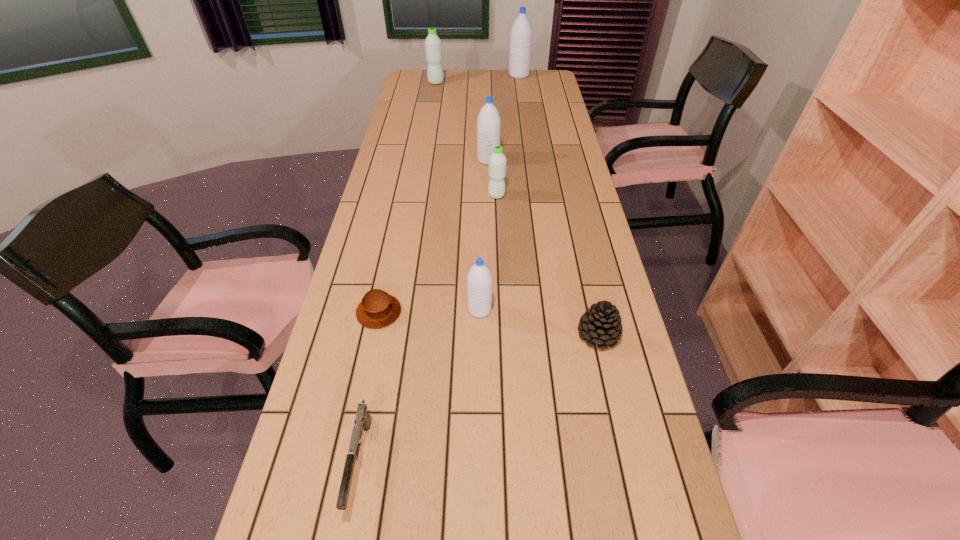
Image resolution: width=960 pixels, height=540 pixels. Identify the location of pinecone. (600, 325).

Where is `the nearest object`? The image size is (960, 540). the nearest object is located at coordinates (362, 421).

Find the location of `gun`. gun is located at coordinates (362, 421).

In order to click on the shortest object in this screenshot , I will do `click(378, 309)`.

Locate an element on the screen. brown muffin is located at coordinates (378, 309).

You are a GUI agent. You are given a task and a screenshot of the screen. Output one action in this format:
    pyautogui.click(x=<x>, y=<y>)
    Task: Click on the vacant region located 0.100m on the front of the tallest object
    Image resolution: width=960 pixels, height=540 pixels.
    Given the screenshot: What is the action you would take?
    pyautogui.click(x=520, y=88)

Find the location of a particular element. The image size is (960, 540). free point located 0.270m on the front of the bigger green water bottle is located at coordinates click(x=431, y=112).

Identify the location of blank area located 0.070m on the back of the second smallest blue water bottle. (488, 145).

Image resolution: width=960 pixels, height=540 pixels. What are the coordinates of `vacant area situated on the right of the right green water bottle` in the screenshot? It's located at (585, 195).

Locate an element on the screen. free space located 0.130m on the front of the nearest water bottle is located at coordinates (479, 363).